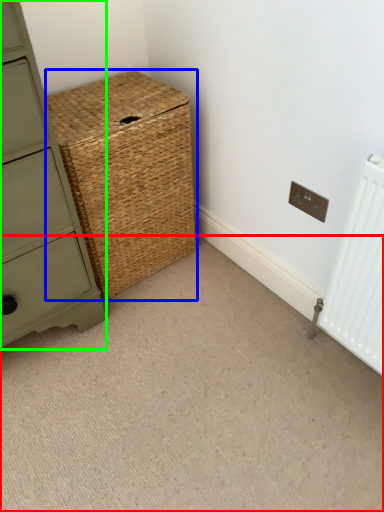
Question: Estimate the real-world distances between objects in this image. Which object is closer to plain (highlighted by a red box), basket (highlighted by a blue box) or chest of drawers (highlighted by a green box)?

Choices:
 (A) basket
 (B) chest of drawers

Answer: (B)